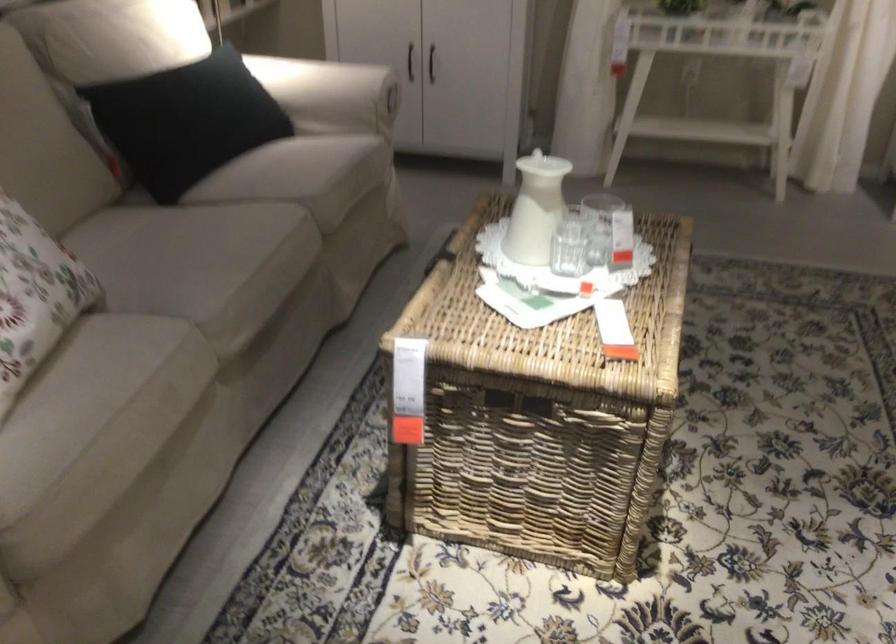
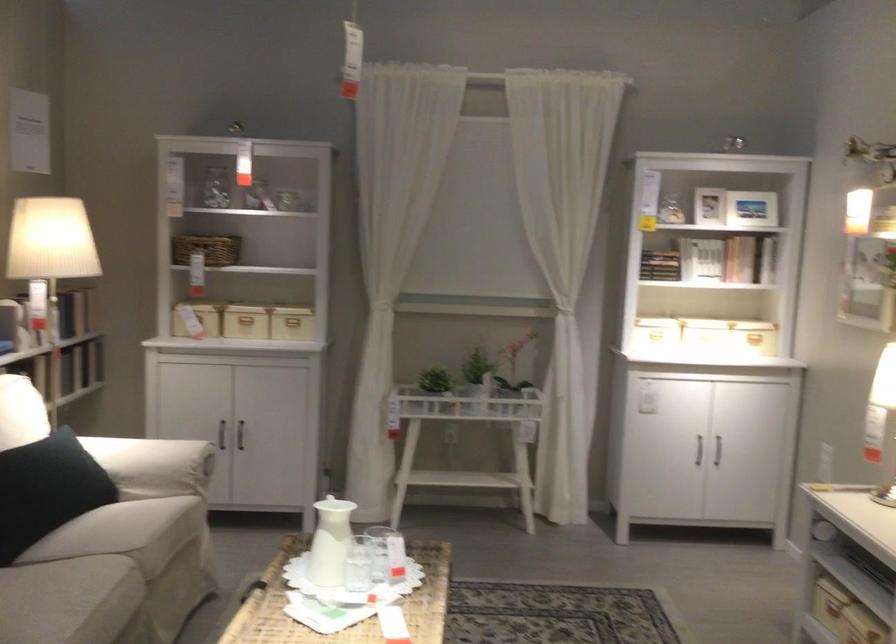
In the second image, find the point that corresponds to (201,118) in the first image.

(47, 489)